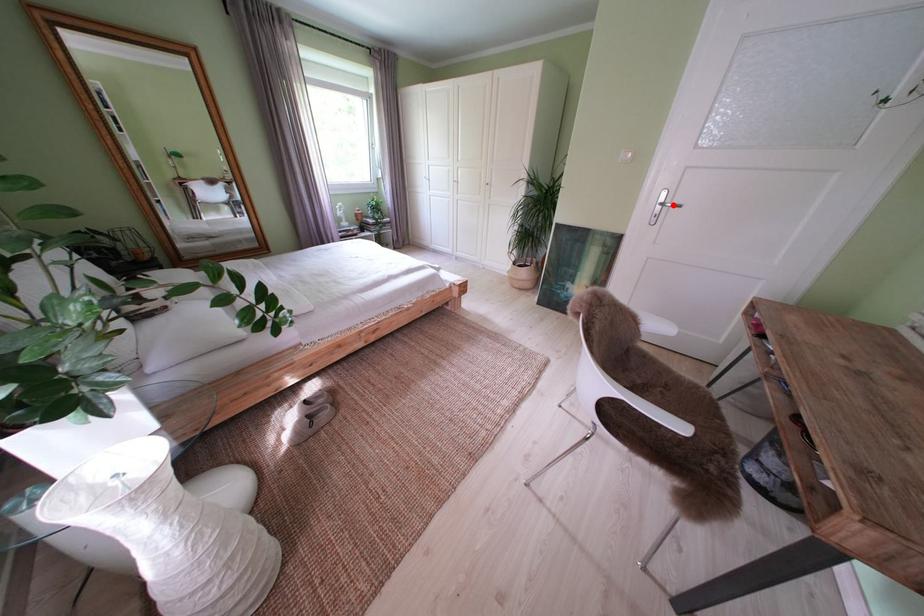
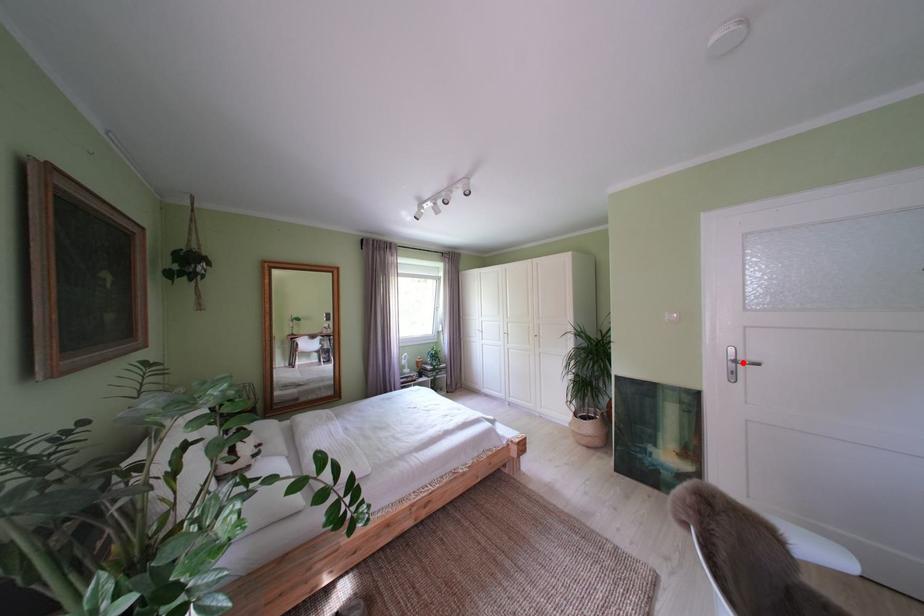
I am providing you with two images of the same scene from different viewpoints. A red point is marked on the first image and another point is marked on the second image. Does the point marked in image1 correspond to the same location as the one in image2?

Yes